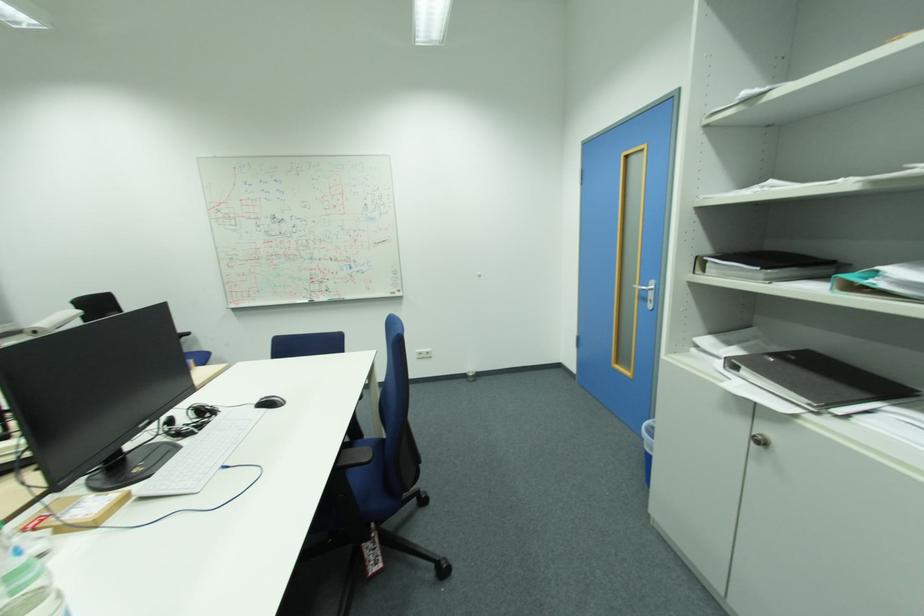
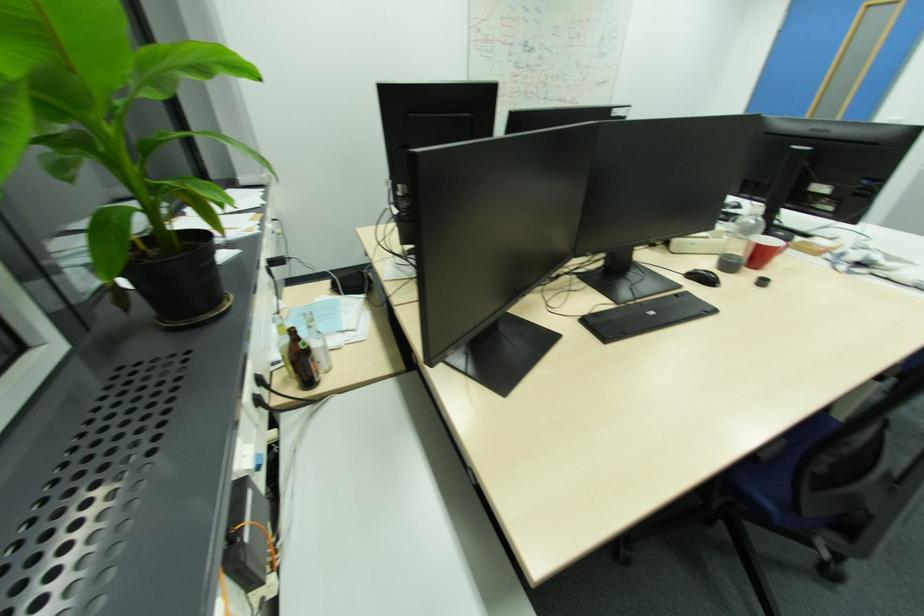
Question: In a continuous first-person perspective shot, in which direction is the camera moving?

Choices:
 (A) Left
 (B) Right
 (C) Forward
 (D) Backward

Answer: (A)